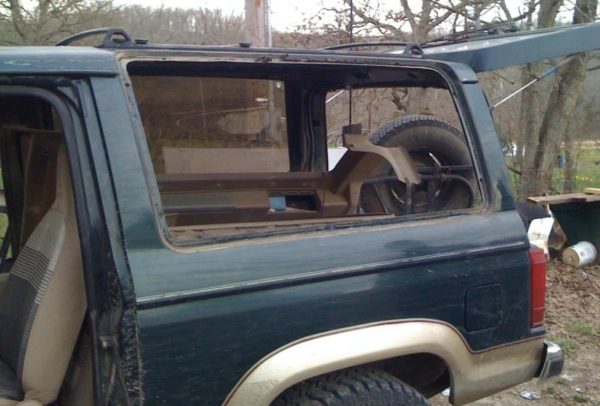
Where is `seat`? The image size is (600, 406). seat is located at coordinates (55, 281).